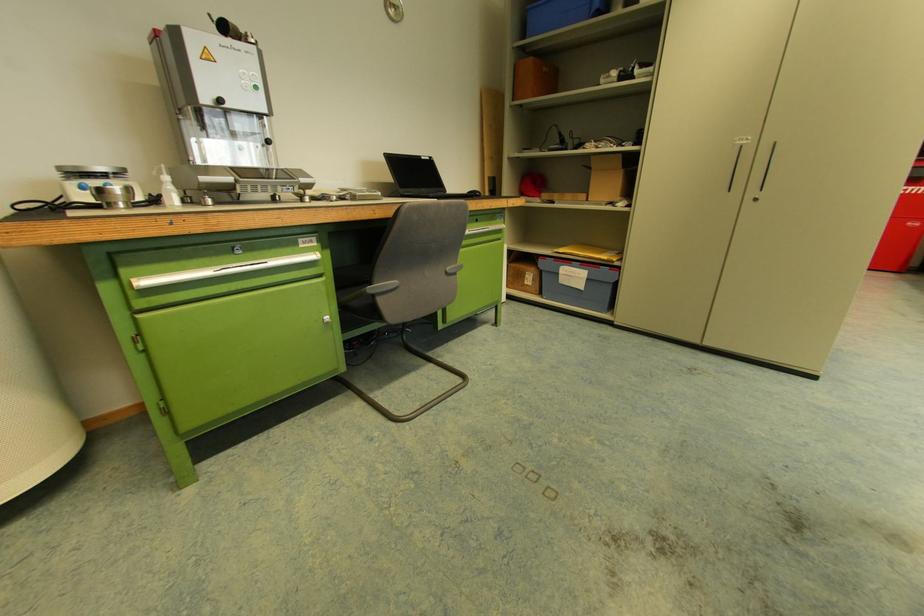
Where is `blue storage bin`? blue storage bin is located at coordinates tap(578, 283).